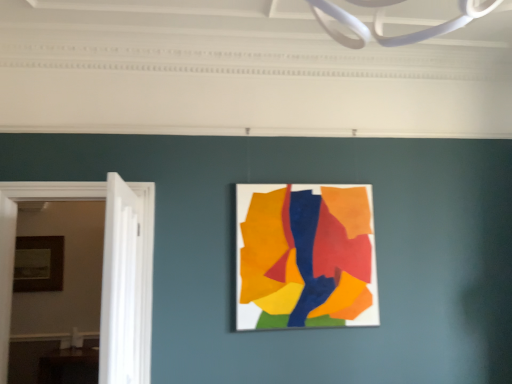
Question: Looking at their shapes, would you say matte paper collage at center, marked as the second picture frame in a back-to-front arrangement, is wider or thinner than wooden picture frame at left, which ranks as the second picture frame in front-to-back order?

Choices:
 (A) thin
 (B) wide

Answer: (A)

Question: Is matte paper collage at center, which is the 2th picture frame in left-to-right order, situated inside wooden picture frame at left, placed as the 1th picture frame when sorted from left to right, or outside?

Choices:
 (A) outside
 (B) inside

Answer: (A)

Question: Based on their relative distances, which object is farther from the white wooden door at left?

Choices:
 (A) matte paper collage at center, marked as the second picture frame in a back-to-front arrangement
 (B) wooden picture frame at left, which ranks as the second picture frame in front-to-back order

Answer: (B)

Question: Which is farther from the wooden picture frame at left, placed as the 1th picture frame when sorted from left to right?

Choices:
 (A) matte paper collage at center, which is the first picture frame from front to back
 (B) white wooden door at left

Answer: (A)